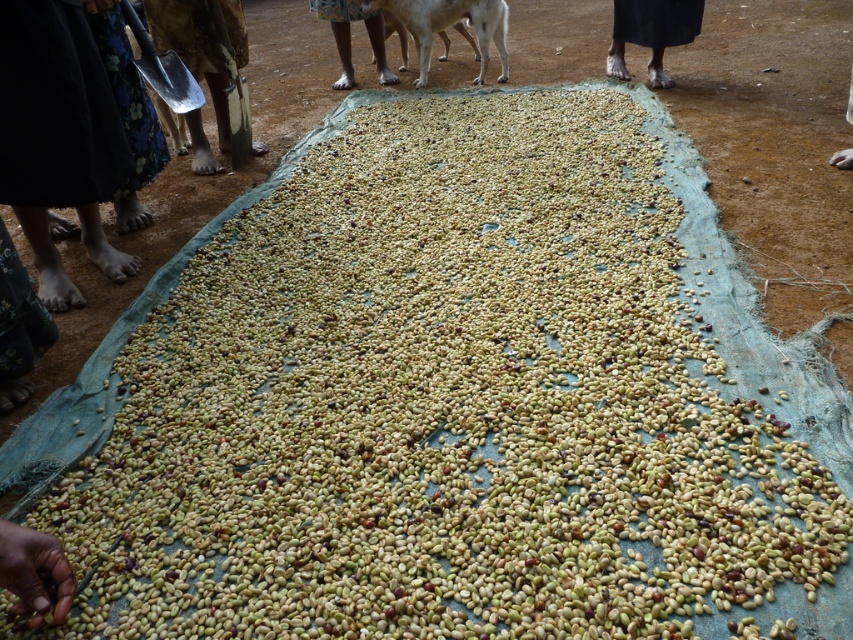
Does white fur dog at center come behind brown skin at center?

That is False.

Who is taller, white fur dog at center or brown skin at center?

With more height is brown skin at center.

Image resolution: width=853 pixels, height=640 pixels. What do you see at coordinates (450, 26) in the screenshot?
I see `white fur dog at center` at bounding box center [450, 26].

Identify the location of white fur dog at center. The width and height of the screenshot is (853, 640). click(x=450, y=26).

Is black fabric at upper right thinner than brown skin at center?

Yes, black fabric at upper right is thinner than brown skin at center.

Is black fabric at upper right wider than brown skin at center?

In fact, black fabric at upper right might be narrower than brown skin at center.

Is point (643, 42) in front of point (393, 76)?

Yes, it is in front of point (393, 76).

Find the location of a particular element. black fabric at upper right is located at coordinates (651, 33).

Does dark blue fabric at lower left have a greater width compared to white fur dog at center?

No.

Is point (59, 131) more distant than point (502, 33)?

No, (59, 131) is in front of (502, 33).

Does point (39, 32) come closer to viewer compared to point (442, 17)?

Yes, point (39, 32) is in front of point (442, 17).

Locate an element on the screen. dark blue fabric at lower left is located at coordinates (57, 138).